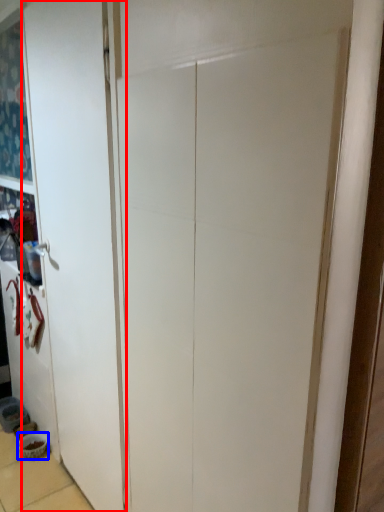
Question: Which object appears farthest to the camera in this image, door (highlighted by a red box) or bowl (highlighted by a blue box)?

Choices:
 (A) door
 (B) bowl

Answer: (B)